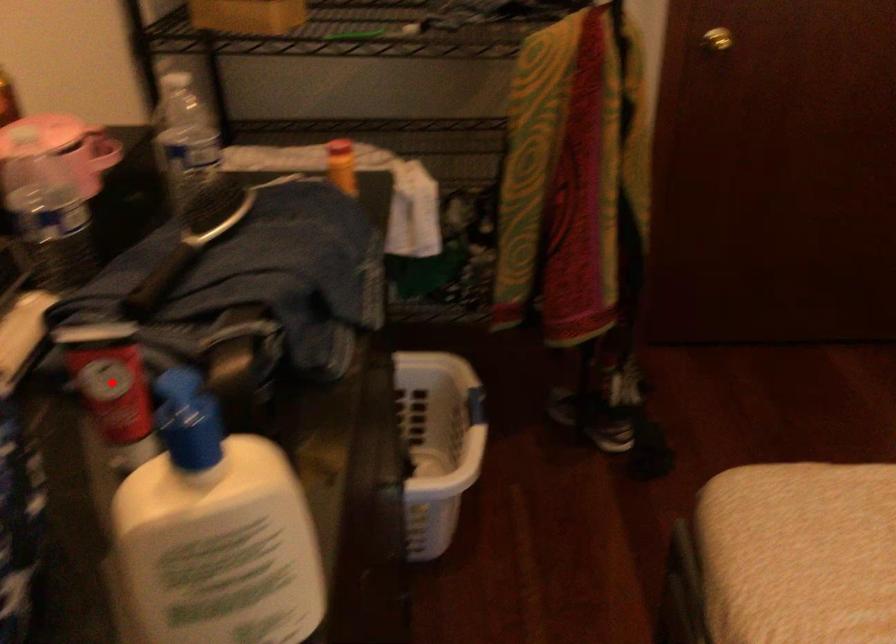
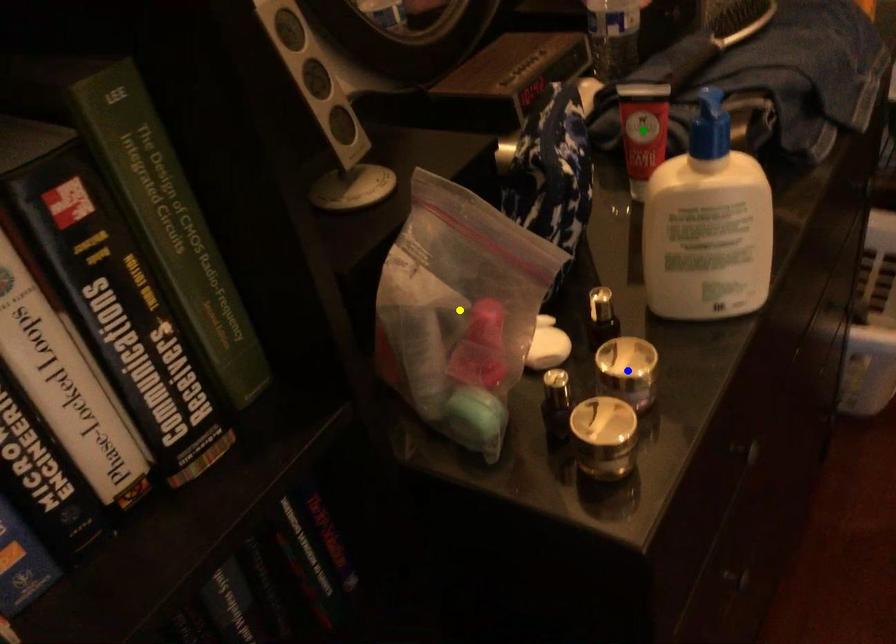
Question: I am providing you with two images of the same scene from different viewpoints. A red point is marked on the first image. You are given multiple points on the second image. Can you choose the point in image 2 that corresponds to the point in image 1?

Choices:
 (A) green point
 (B) blue point
 (C) yellow point

Answer: (A)